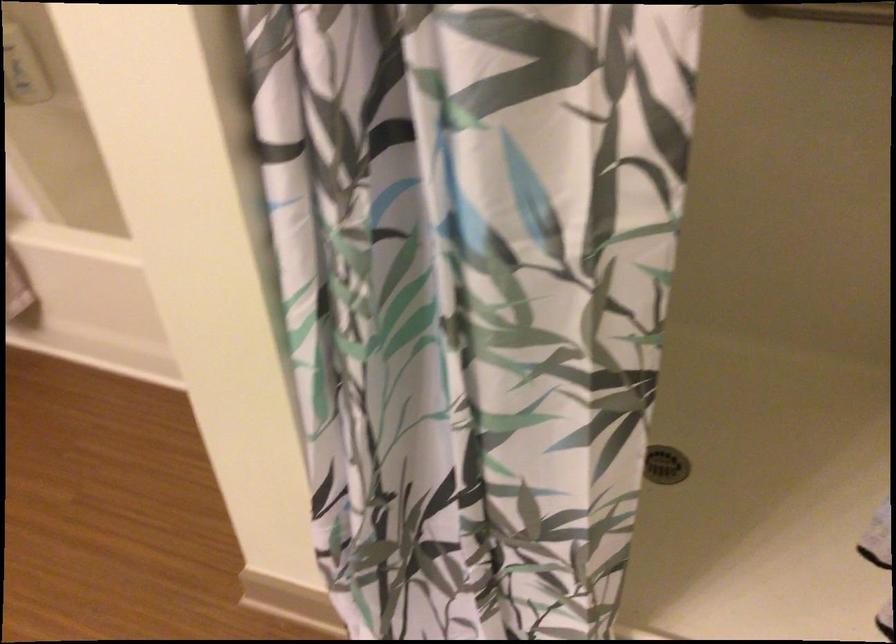
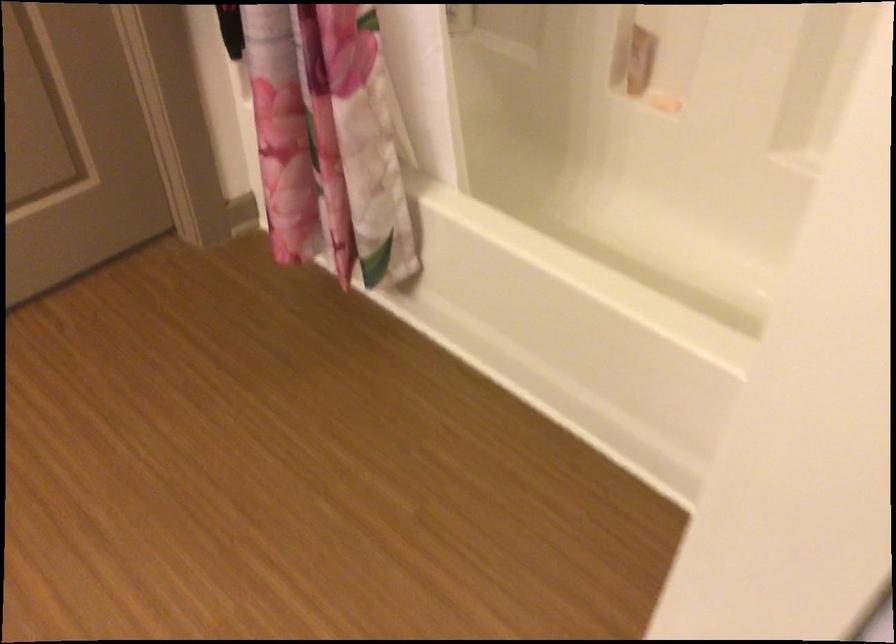
Question: The images are taken continuously from a first-person perspective. In which direction is your viewpoint rotating?

Choices:
 (A) Left
 (B) Right
 (C) Up
 (D) Down

Answer: (A)